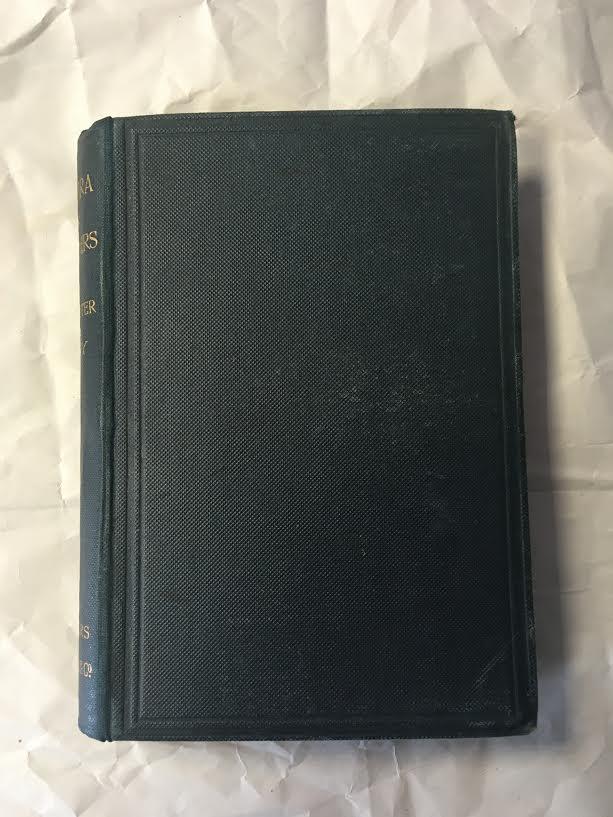
Identify the location of book. This screenshot has height=817, width=613. (322, 493).